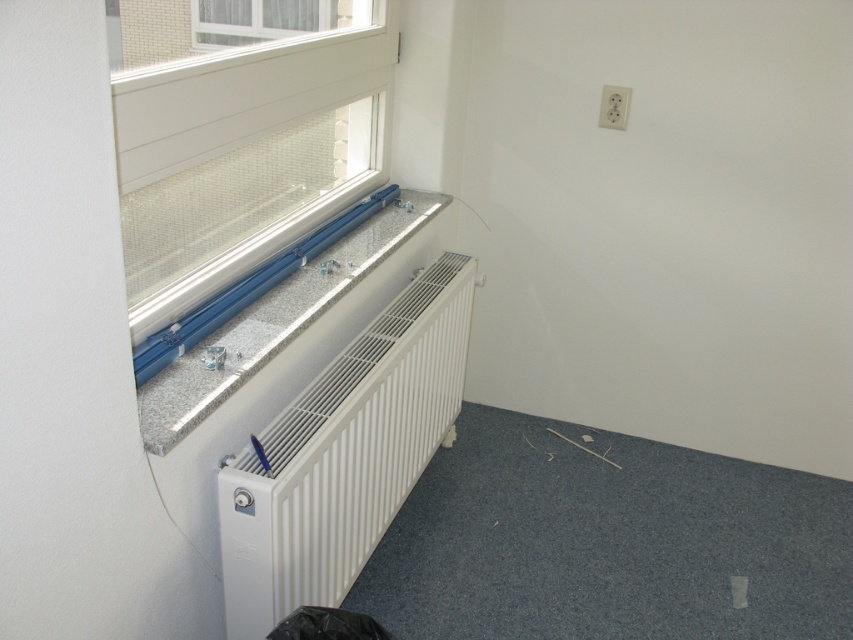
Does white matte radiator at lower center have a larger size compared to granite/textured stone window sill at lower left?

Yes, white matte radiator at lower center is bigger than granite/textured stone window sill at lower left.

This screenshot has height=640, width=853. What do you see at coordinates (344, 454) in the screenshot?
I see `white matte radiator at lower center` at bounding box center [344, 454].

Does point (326, 422) lie in front of point (187, 362)?

No, (326, 422) is further to viewer.

Locate an element on the screen. The image size is (853, 640). white matte radiator at lower center is located at coordinates (344, 454).

Describe the element at coordinates (247, 161) in the screenshot. I see `white textured window at upper left` at that location.

Which is behind, point (231, 305) or point (289, 282)?

The point (289, 282) is behind.

In order to click on white textured window at upper left in this screenshot , I will do `click(247, 161)`.

Is white textured window at upper left shorter than white matte radiator at lower center?

Incorrect, white textured window at upper left's height does not fall short of white matte radiator at lower center's.

Locate an element on the screen. The image size is (853, 640). white textured window at upper left is located at coordinates (247, 161).

You are a GUI agent. You are given a task and a screenshot of the screen. Output one action in this format:
    pyautogui.click(x=<x>, y=<y>)
    Task: Click on the white textured window at upper left
    
    Given the screenshot: What is the action you would take?
    pyautogui.click(x=247, y=161)